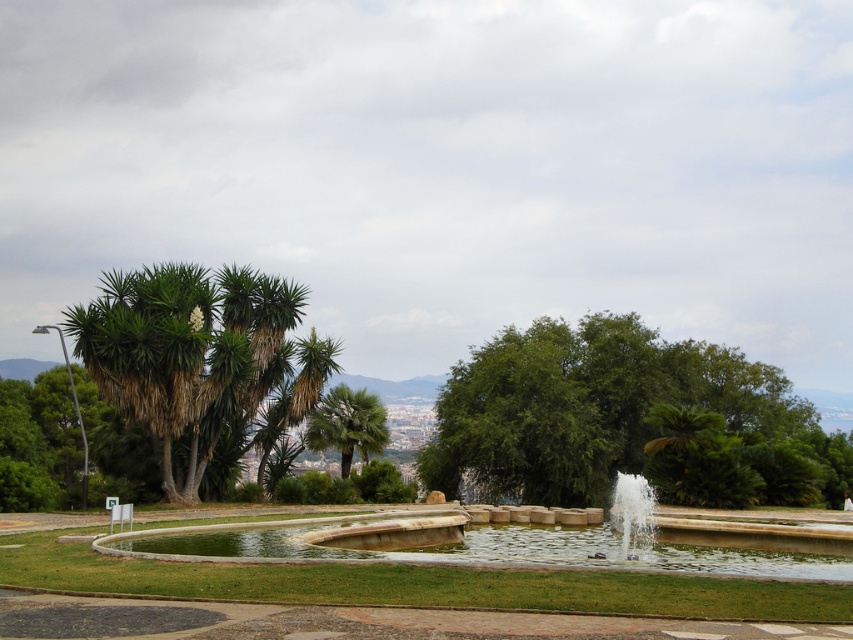
You are a landscape architect designing a walking path between the green leafy trees at left. What is the minimum width required for the path to fit between them?

The green leafy trees at left are 36.21 meters apart, so the path should be at least 36.21 meters wide to fit between them.

You are standing in the park and want to walk towards the two points marked in the image. Which point, point (149, 275) or point (363, 445), will you reach first?

Point (149, 275) is closer to the viewer than point (363, 445), so you will reach point (149, 275) first.

You are standing in the park and want to take a photo of both the fountain and the palm trees. You notice two points in your viewfinder labeled as point 1 at coordinates point (x=624, y=332) and point 2 at coordinates point (x=227, y=301). Which point is closer to you, the photographer?

Point (x=227, y=301) is closer to you because the description states that point (x=624, y=332) is further to the camera than point (x=227, y=301).